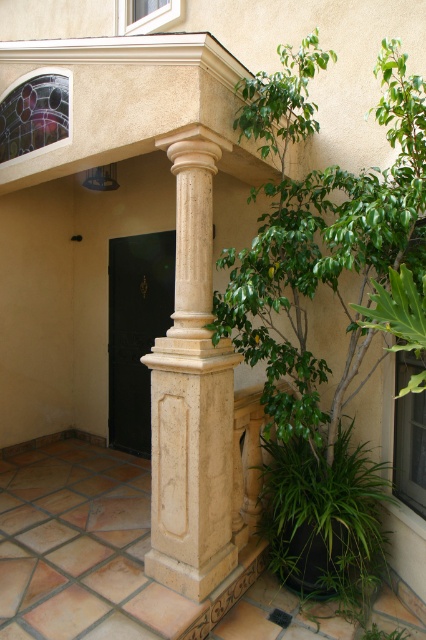
Is point (190, 392) farther from camera compared to point (172, 259)?

No.

Does beige stone column at center have a lesser width compared to black polished door at center?

Yes, beige stone column at center is thinner than black polished door at center.

What do you see at coordinates (192, 394) in the screenshot? Image resolution: width=426 pixels, height=640 pixels. I see `beige stone column at center` at bounding box center [192, 394].

Image resolution: width=426 pixels, height=640 pixels. I want to click on beige stone column at center, so click(192, 394).

What do you see at coordinates (192, 394) in the screenshot? The height and width of the screenshot is (640, 426). I see `beige stone column at center` at bounding box center [192, 394].

Between beige stone column at center and green leafy plant at lower right, which one is positioned higher?

beige stone column at center is higher up.

You are a GUI agent. You are given a task and a screenshot of the screen. Output one action in this format:
    pyautogui.click(x=<x>, y=<y>)
    Task: Click on the beige stone column at center
    
    Given the screenshot: What is the action you would take?
    pyautogui.click(x=192, y=394)

Does green leafy plant at lower right have a greater height compared to black polished door at center?

Incorrect, green leafy plant at lower right's height is not larger of black polished door at center's.

Who is more forward, (x=276, y=568) or (x=129, y=396)?

Point (x=276, y=568) is in front.

Which is in front, point (288, 481) or point (149, 280)?

Point (288, 481)

Where is `green leafy plant at lower right`? This screenshot has width=426, height=640. green leafy plant at lower right is located at coordinates (324, 516).